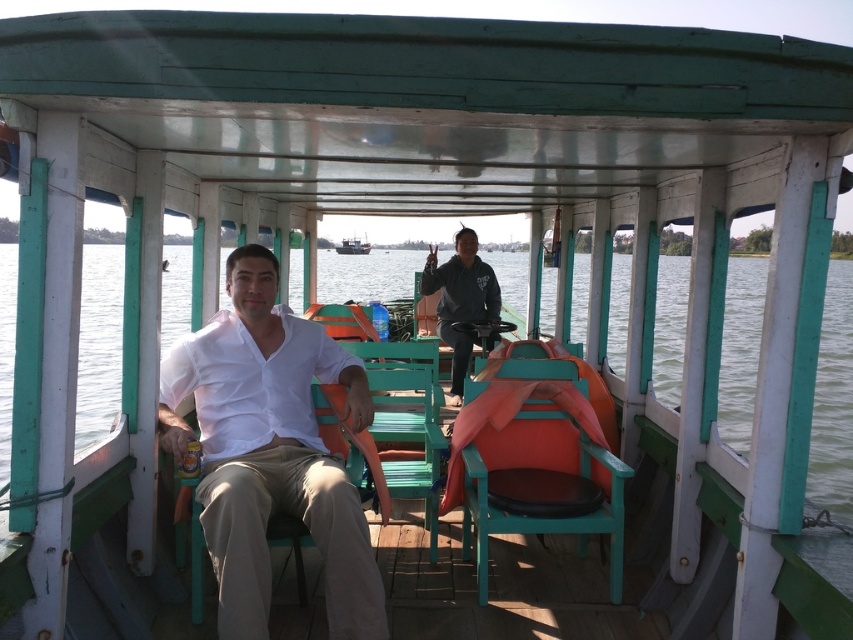
Question: Among these points, which one is farthest from the camera?

Choices:
 (A) (564, 467)
 (B) (352, 248)
 (C) (370, 328)
 (D) (460, 307)

Answer: (B)

Question: Is white matte shirt at center below green wood chair at center?

Choices:
 (A) yes
 (B) no

Answer: (B)

Question: Can you confirm if green wood chair at center is wider than dark gray hoodie at center?

Choices:
 (A) no
 (B) yes

Answer: (A)

Question: From the image, what is the correct spatial relationship of white matte shirt at center in relation to teal wood chair at center?

Choices:
 (A) below
 (B) above

Answer: (B)

Question: Estimate the real-world distances between objects in this image. Which object is closer to the dark gray hoodie at center?

Choices:
 (A) green wood chair at center
 (B) teal wood chair at center
 (C) wooden boat at center
 (D) white matte shirt at center

Answer: (A)

Question: Which is nearer to the wooden boat at center?

Choices:
 (A) teal wood chair at center
 (B) dark gray hoodie at center
 (C) green wood chair at center
 (D) white matte shirt at center

Answer: (B)